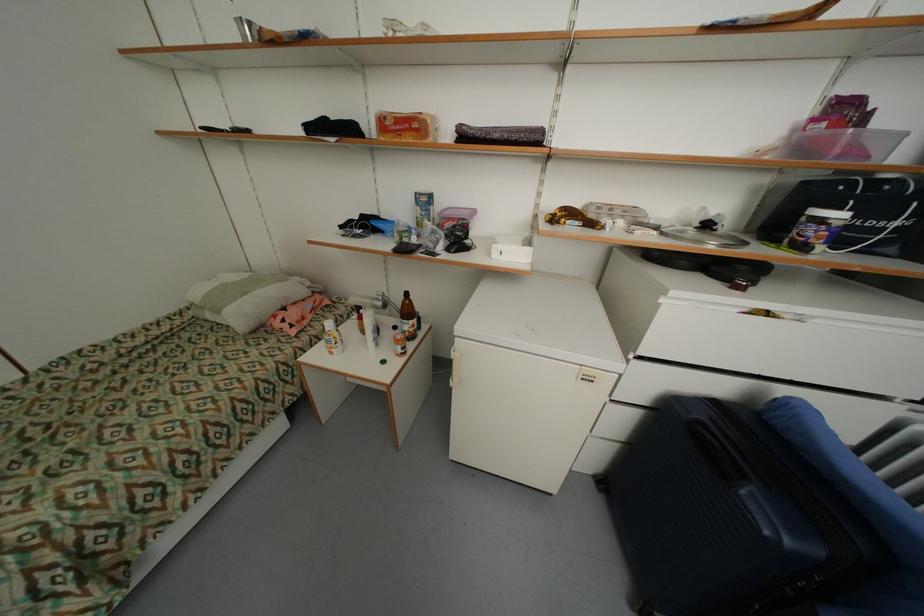
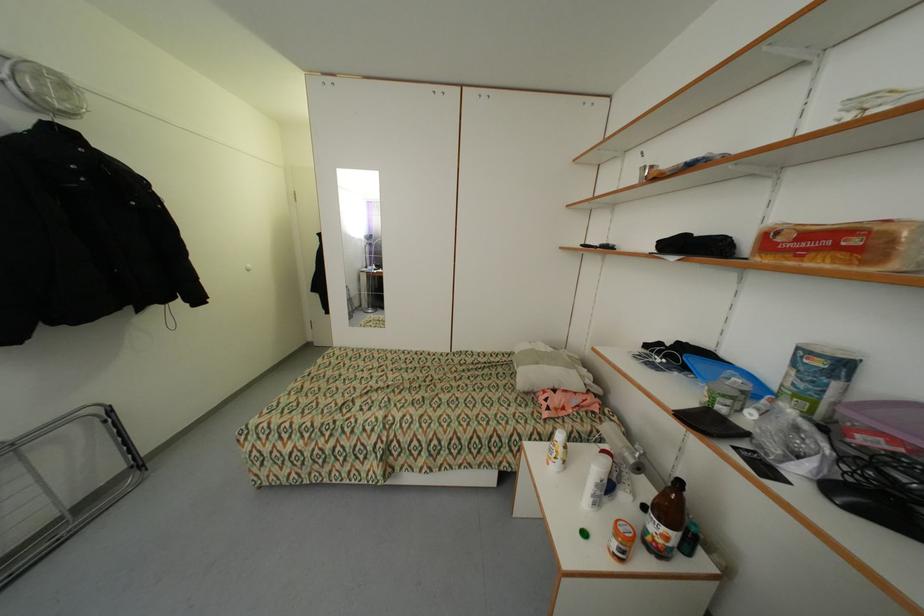
The point at (386, 304) is marked in the first image. Where is the corresponding point in the second image?

(638, 462)